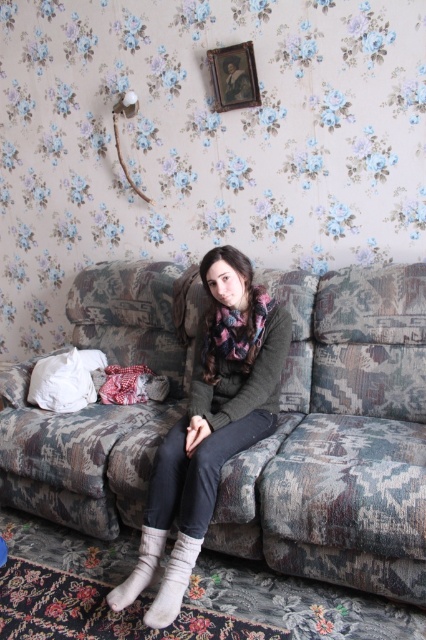
Question: From the image, what is the correct spatial relationship of camouflage fabric couch at center in relation to white fluffy pillow at left?

Choices:
 (A) right
 (B) left

Answer: (A)

Question: Which of the following is the closest to the observer?

Choices:
 (A) (63, 476)
 (B) (184, 566)

Answer: (B)

Question: Which object is the farthest from the white fluffy pillow at left?

Choices:
 (A) camouflage fabric couch at center
 (B) white soft sock at lower center
 (C) knit wool scarf at center

Answer: (A)

Question: Does knit wool scarf at center have a lesser width compared to white fuzzy socks at lower center?

Choices:
 (A) yes
 (B) no

Answer: (B)

Question: Which point is closer to the camera taking this photo?

Choices:
 (A) (206, 524)
 (B) (176, 580)
 (C) (368, 548)

Answer: (C)

Question: Can you confirm if camouflage fabric couch at center is bigger than white fuzzy socks at lower center?

Choices:
 (A) no
 (B) yes

Answer: (B)